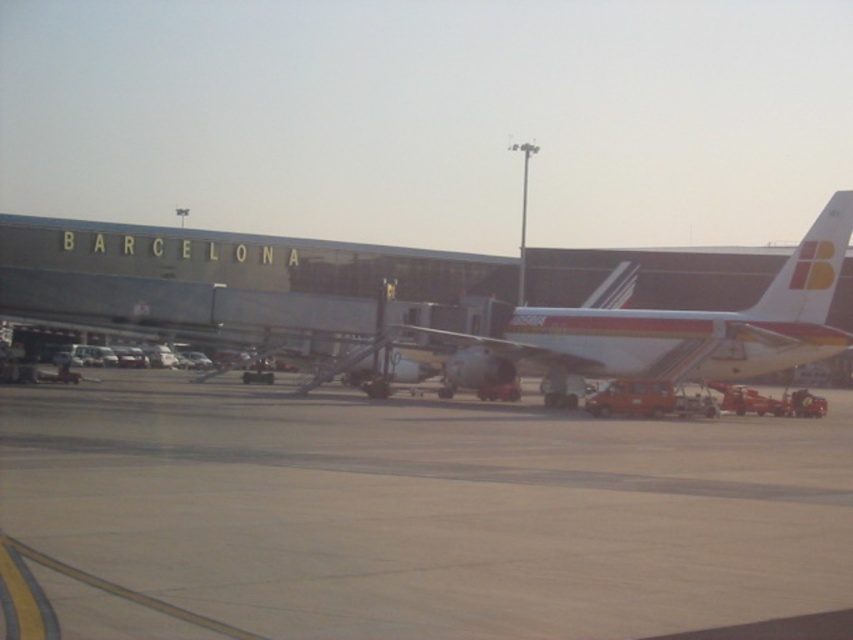
You are a maintenance worker needing to reach the white glossy airplane at center from the brown concrete tarmac at center. Given that your equipment cart is 2 meters wide, can you safely maneuver it between them?

The brown concrete tarmac at center and white glossy airplane at center are 11.41 meters apart. Since the equipment cart is only 2 meters wide, there is sufficient space to safely maneuver it between them.

You are a passenger standing on the brown concrete tarmac at center and want to board the white glossy airplane at center. How would you describe the position of the airplane relative to your current location?

The white glossy airplane at center is behind the brown concrete tarmac at center since the tarmac is closer to you, making the airplane further away.

You are standing at the point labeled as point (412, 515) in the image. What surface are you currently standing on?

The point (412, 515) is on brown concrete tarmac at center, so you are standing on the brown concrete tarmac at center.